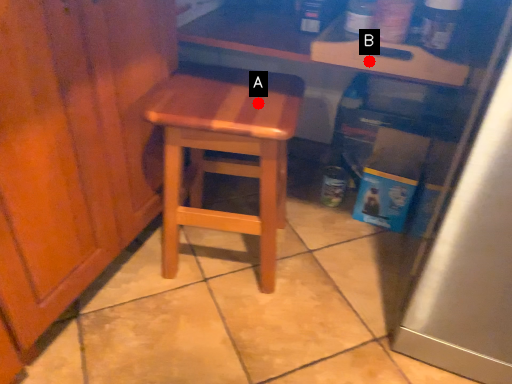
Question: Two points are circled on the image, labeled by A and B beside each circle. Among these points, which one is farthest from the camera?

Choices:
 (A) A is further
 (B) B is further

Answer: (A)